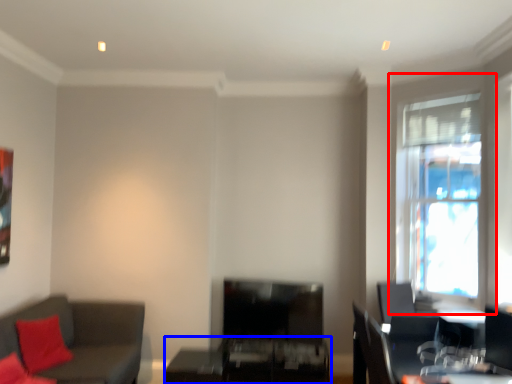
Question: Which of the following is the farthest to the observer, window (highlighted by a red box) or table (highlighted by a blue box)?

Choices:
 (A) window
 (B) table

Answer: (B)